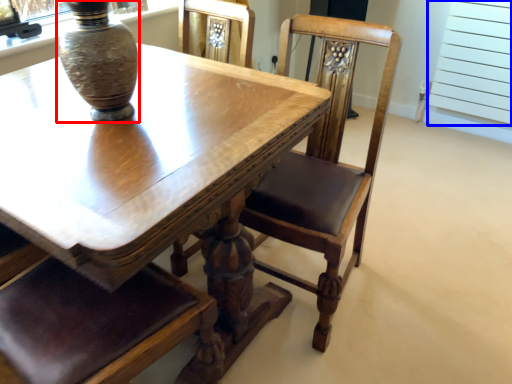
Question: Among these objects, which one is nearest to the camera, vase (highlighted by a red box) or screen door (highlighted by a blue box)?

Choices:
 (A) vase
 (B) screen door

Answer: (A)